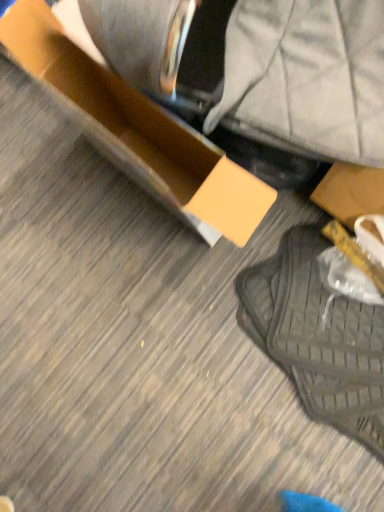
At what (x,y) coordinates should I click in order to perform the action: click on vacant area that lies between matte cardboard box at center and black mesh bag at lower right. Please return your answer as a coordinate pair (x, y). The image size is (384, 512). Looking at the image, I should click on (171, 239).